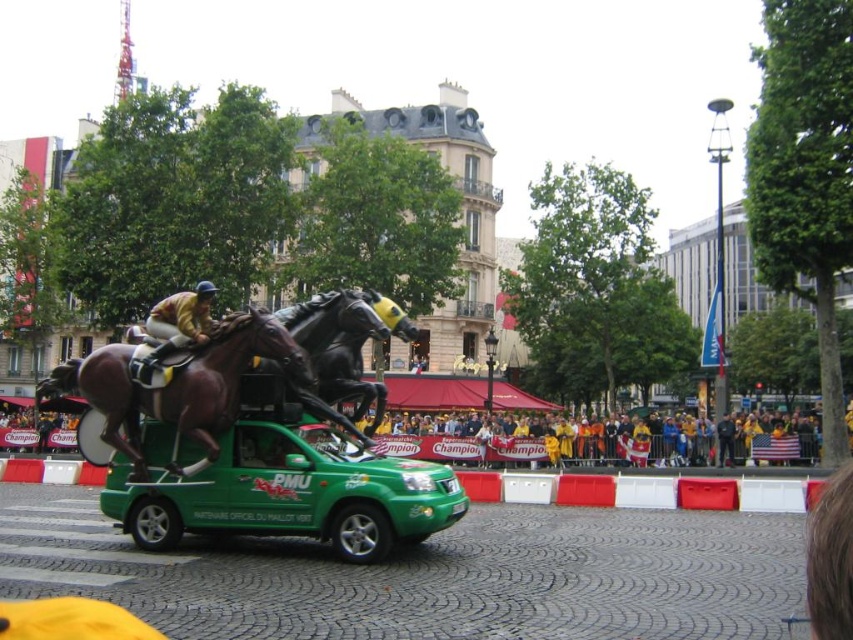
Question: Which point is closer to the camera?

Choices:
 (A) (292, 355)
 (B) (289, 388)

Answer: (A)

Question: In this image, where is green plastic toy car at center located relative to shiny black horse at center?

Choices:
 (A) above
 (B) below

Answer: (B)

Question: Is green plastic toy car at center thinner than yellow fabric at lower center?

Choices:
 (A) yes
 (B) no

Answer: (A)

Question: Which object is closer to the camera taking this photo?

Choices:
 (A) shiny brown horse at center
 (B) yellow fabric at lower center

Answer: (A)

Question: Can you confirm if green plastic toy car at center is positioned to the right of yellow fabric at lower center?

Choices:
 (A) yes
 (B) no

Answer: (B)

Question: Which of the following is the farthest from the observer?

Choices:
 (A) green plastic toy car at center
 (B) shiny black horse at center
 (C) shiny brown horse at center
 (D) yellow fabric at lower center

Answer: (D)